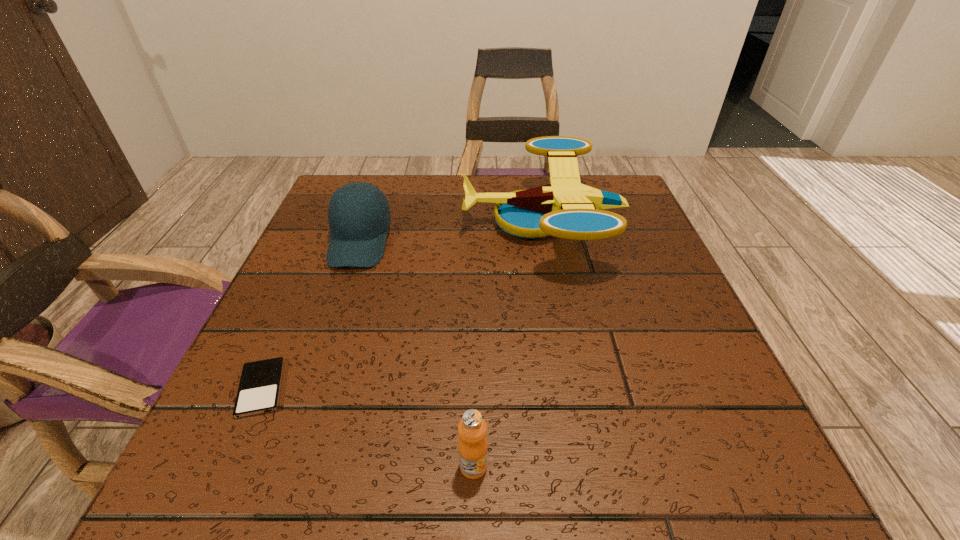
Where is `drone that is positioned at the far edge`? Image resolution: width=960 pixels, height=540 pixels. drone that is positioned at the far edge is located at coordinates (565, 208).

At what (x,y) coordinates should I click in order to perform the action: click on baseball cap that is at the far edge. Please return your answer as a coordinate pair (x, y). Looking at the image, I should click on (358, 231).

You are a GUI agent. You are given a task and a screenshot of the screen. Output one action in this format:
    pyautogui.click(x=<x>, y=<y>)
    Task: Click on the object positioned at the near edge
    This screenshot has width=960, height=540.
    Given the screenshot: What is the action you would take?
    [473, 447]

Where is `baseball cap that is positioned at the left edge`? This screenshot has height=540, width=960. baseball cap that is positioned at the left edge is located at coordinates (358, 231).

Image resolution: width=960 pixels, height=540 pixels. What are the coordinates of `iPod at the left edge` in the screenshot? It's located at (259, 389).

I want to click on object that is positioned at the right edge, so click(565, 208).

Identify the location of object located at the far left corner. (358, 231).

This screenshot has height=540, width=960. I want to click on object that is at the far right corner, so click(565, 208).

Identify the location of free space at the near edge of the desktop. (423, 497).

This screenshot has height=540, width=960. I want to click on free space at the left edge, so click(x=283, y=336).